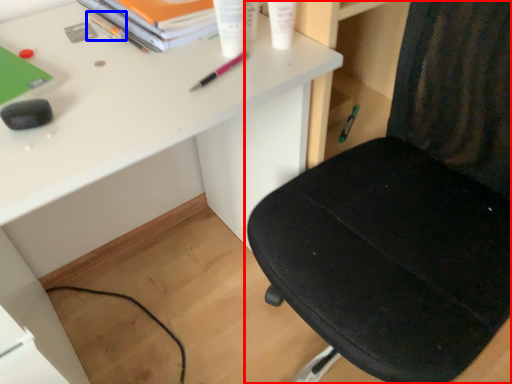
Question: Which object is further to the camera taking this photo, chair (highlighted by a red box) or stationery (highlighted by a blue box)?

Choices:
 (A) chair
 (B) stationery

Answer: (B)